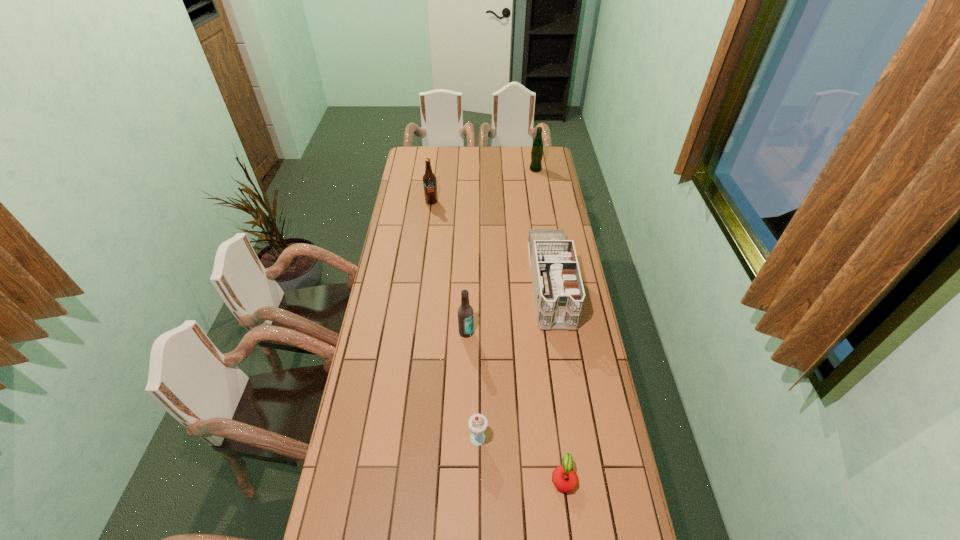
Where is `free area in between the fifth nearest object and the fifth farthest object`? This screenshot has width=960, height=540. free area in between the fifth nearest object and the fifth farthest object is located at coordinates (455, 318).

At what (x,y) coordinates should I click in order to perform the action: click on free space that is in between the farthest beer bottle and the second beer bottle from right to left. Please return your answer as a coordinate pair (x, y). The image size is (960, 540). Looking at the image, I should click on (501, 251).

The height and width of the screenshot is (540, 960). I want to click on vacant region between the second nearest object and the apple, so click(x=520, y=456).

Locate an element on the screen. unoccupied area between the dollhouse and the nearest object is located at coordinates (557, 381).

Select which object appears as the fifth closest to the rightmost beer bottle. Please provide its 2D coordinates. Your answer should be formatted as a tuple, i.e. [(x, y)], where the tuple contains the x and y coordinates of a point satisfying the conditions above.

[(565, 479)]

Where is `the fourth closest object relative to the farthest object`? This screenshot has width=960, height=540. the fourth closest object relative to the farthest object is located at coordinates (477, 423).

Choose which beer bottle is the third nearest neighbor to the milkshake. Please provide its 2D coordinates. Your answer should be formatted as a tuple, i.e. [(x, y)], where the tuple contains the x and y coordinates of a point satisfying the conditions above.

[(537, 147)]

Identify which beer bottle is the nearest to the shortest object. Please provide its 2D coordinates. Your answer should be formatted as a tuple, i.e. [(x, y)], where the tuple contains the x and y coordinates of a point satisfying the conditions above.

[(465, 312)]

Find the location of a particular element. free spot that satisfies the following two spatial constraints: 1. at the entrance of the dollhouse; 2. on the straw side of the milkshake is located at coordinates (573, 435).

What are the coordinates of `vacant point that satisfies the following two spatial constraints: 1. on the label of the leftmost object; 2. on the right side of the nearest object` in the screenshot? It's located at (396, 478).